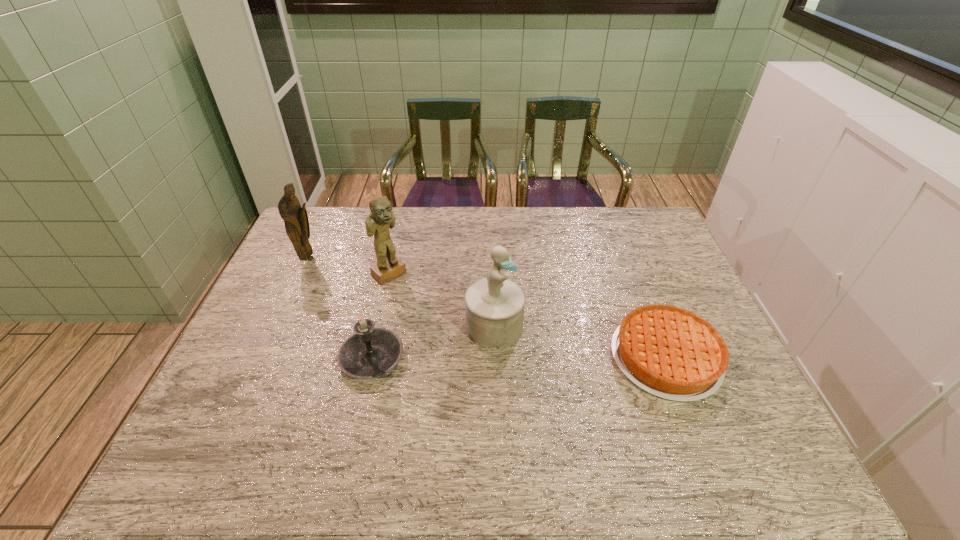
Locate an element on the screen. free location located on the front-facing side of the leftmost object is located at coordinates (379, 297).

You are a GUI agent. You are given a task and a screenshot of the screen. Output one action in this format:
    pyautogui.click(x=<x>, y=<y>)
    Task: Click on the vacant point located on the front-facing side of the leftmost object
    This screenshot has height=540, width=960.
    Given the screenshot: What is the action you would take?
    pyautogui.click(x=326, y=269)

In order to click on vacant position located on the front-facing side of the second figurine from right to left in this screenshot , I will do `click(463, 341)`.

This screenshot has height=540, width=960. Find the location of `free spot located 0.070m on the front-facing side of the second figurine from right to left`. free spot located 0.070m on the front-facing side of the second figurine from right to left is located at coordinates (412, 294).

Locate an element on the screen. vacant space located 0.290m on the front-facing side of the second figurine from right to left is located at coordinates (458, 336).

Locate an element on the screen. The image size is (960, 540). blank space located at the beak of the rightmost figurine is located at coordinates (639, 395).

The image size is (960, 540). I want to click on vacant region located 0.300m at the beak of the rightmost figurine, so [x=628, y=389].

This screenshot has height=540, width=960. What are the coordinates of `vacant region located at the beak of the rightmost figurine` in the screenshot? It's located at (660, 404).

Where is `object located in the near edge section of the desktop`? object located in the near edge section of the desktop is located at coordinates (672, 353).

This screenshot has height=540, width=960. I want to click on object that is at the left edge, so click(x=295, y=217).